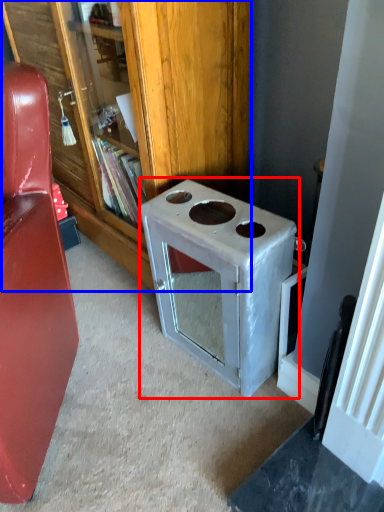
Question: Which of the following is the closest to the observer, appliance (highlighted by a red box) or bookcase (highlighted by a blue box)?

Choices:
 (A) appliance
 (B) bookcase

Answer: (A)